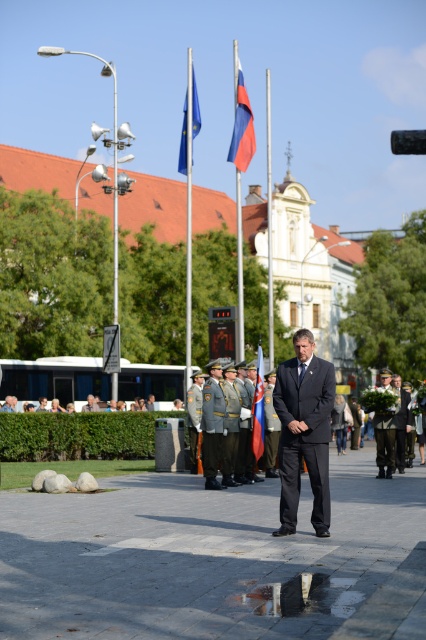
Does gray uniform at center have a greater width compared to light brown leather jacket at center?

Incorrect, gray uniform at center's width does not surpass light brown leather jacket at center's.

What do you see at coordinates (212, 424) in the screenshot?
I see `gray uniform at center` at bounding box center [212, 424].

Identify the location of gray uniform at center. The height and width of the screenshot is (640, 426). (212, 424).

Which is more to the left, dark suit at center or light brown leather jacket at center?

light brown leather jacket at center

I want to click on dark suit at center, so click(402, 422).

Is point (201, 412) more distant than point (374, 436)?

No, (201, 412) is closer to viewer.

Does point (219, 445) come in front of point (385, 442)?

Yes.

Find the location of `gray uniform at center`. gray uniform at center is located at coordinates (212, 424).